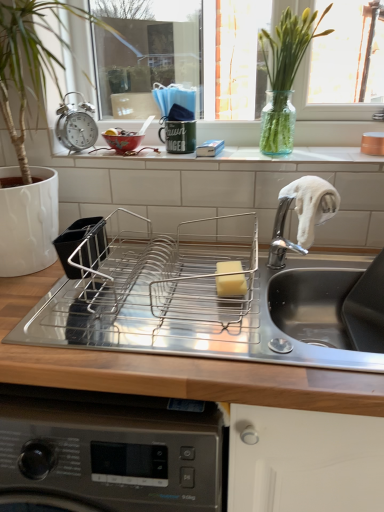
Locate an element on the screen. free space in front of yellow sponge at center is located at coordinates (228, 336).